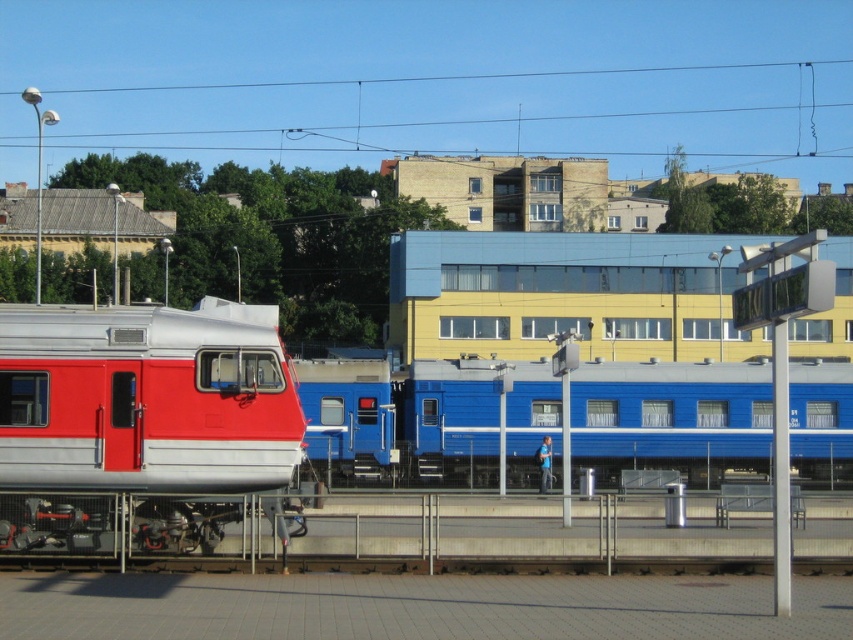
You are standing at the train station and want to determine which of the two points, point (662, 403) or point (291, 131), is closer to you. Based on the scene provided, which point is nearer?

Point (662, 403) is closer to the camera than point (291, 131), so it is the nearer point.

You are a passenger trying to board a train. You see the blue glossy train car at center and the metallic red train at left. Which train car is taller?

The blue glossy train car at center is much taller than the metallic red train at left.